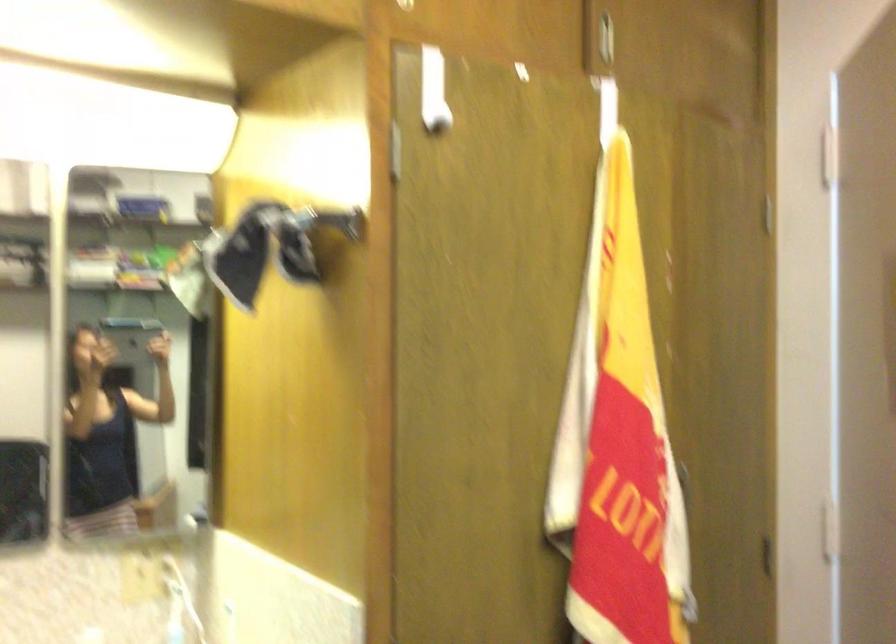
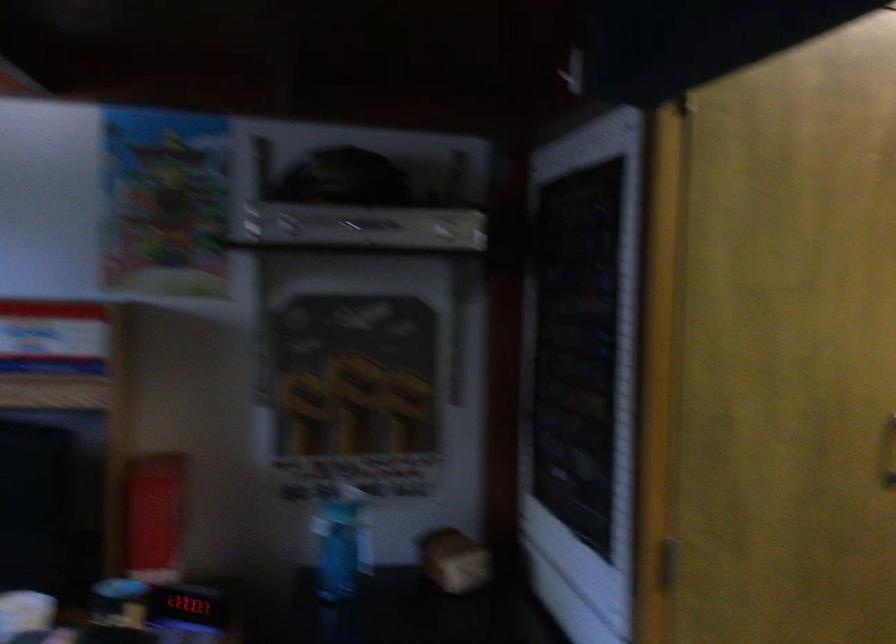
What movement of the cameraman would produce the second image?

The movement direction of the cameraman is left, backward.